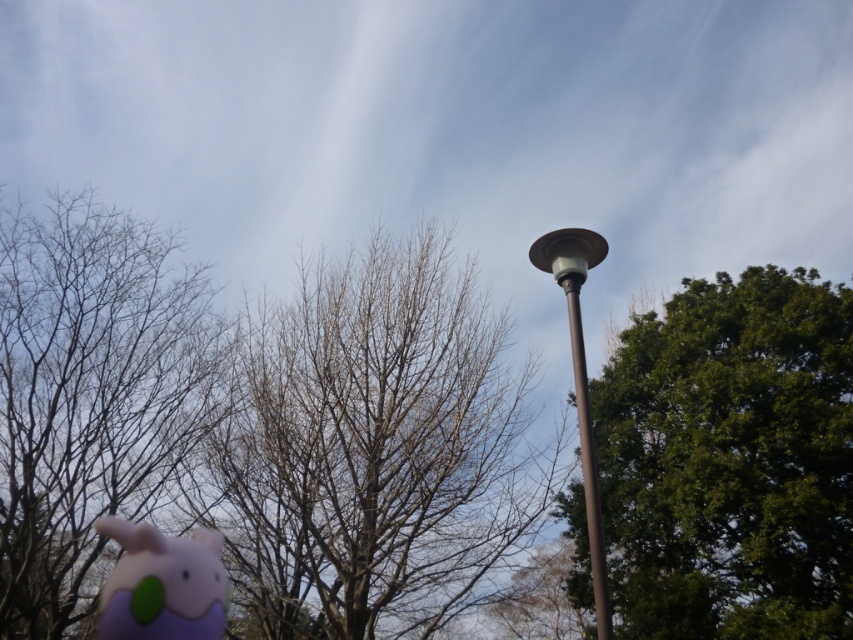
Can you confirm if bare branches at left is shorter than purple felt plushie at lower left?

Correct, bare branches at left is not as tall as purple felt plushie at lower left.

Is bare branches at left closer to the viewer compared to purple felt plushie at lower left?

That is False.

Who is more distant from viewer, (90, 540) or (183, 550)?

The point (90, 540) is more distant.

You are a GUI agent. You are given a task and a screenshot of the screen. Output one action in this format:
    pyautogui.click(x=<x>, y=<y>)
    Task: Click on the bare branches at left
    The width and height of the screenshot is (853, 640).
    Given the screenshot: What is the action you would take?
    pyautogui.click(x=91, y=396)

Can you confirm if bare branches at left is bigger than brown metallic pole at center?

No.

Is point (160, 387) positioned before point (573, 332)?

No, it is behind (573, 332).

Locate an element on the screen. This screenshot has width=853, height=640. bare branches at left is located at coordinates (91, 396).

Which is below, bare wood tree at center or purple felt plushie at lower left?

bare wood tree at center

Is bare wood tree at center above purple felt plushie at lower left?

Incorrect, bare wood tree at center is not positioned above purple felt plushie at lower left.

Looking at this image, who is more distant from viewer, (351, 400) or (212, 628)?

The point (351, 400) is more distant.

Identify the location of bare wood tree at center. The image size is (853, 640). (374, 449).